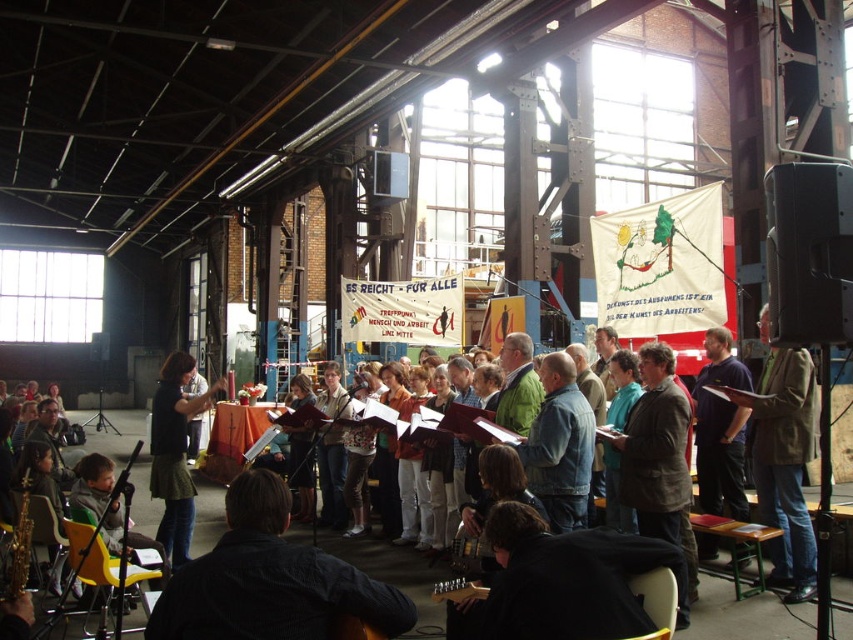
Is brown leather jacket at right bigger than green fabric skirt at center?

Actually, brown leather jacket at right might be smaller than green fabric skirt at center.

Is point (796, 554) positioned behind point (177, 493)?

That is False.

Where is `brown leather jacket at right`? Image resolution: width=853 pixels, height=640 pixels. brown leather jacket at right is located at coordinates (784, 461).

Which of these two, dark blue shirt at center or brown leather jacket at right, stands taller?

Standing taller between the two is brown leather jacket at right.

Consider the image. Measure the distance between dark blue shirt at center and brown leather jacket at right.

A distance of 9.29 meters exists between dark blue shirt at center and brown leather jacket at right.

Who is more distant from viewer, (248, 605) or (753, 401)?

The point (753, 401) is behind.

Identify the location of dark blue shirt at center. (270, 579).

Is dark blue shirt at center in front of green fabric skirt at center?

Yes, dark blue shirt at center is in front of green fabric skirt at center.

In the scene shown: Who is more forward, (180,573) or (165,504)?

Point (180,573) is more forward.

Who is more distant from viewer, (321, 600) or (164, 449)?

The point (164, 449) is more distant.

Find the location of `dark blue shirt at center`. dark blue shirt at center is located at coordinates (270, 579).